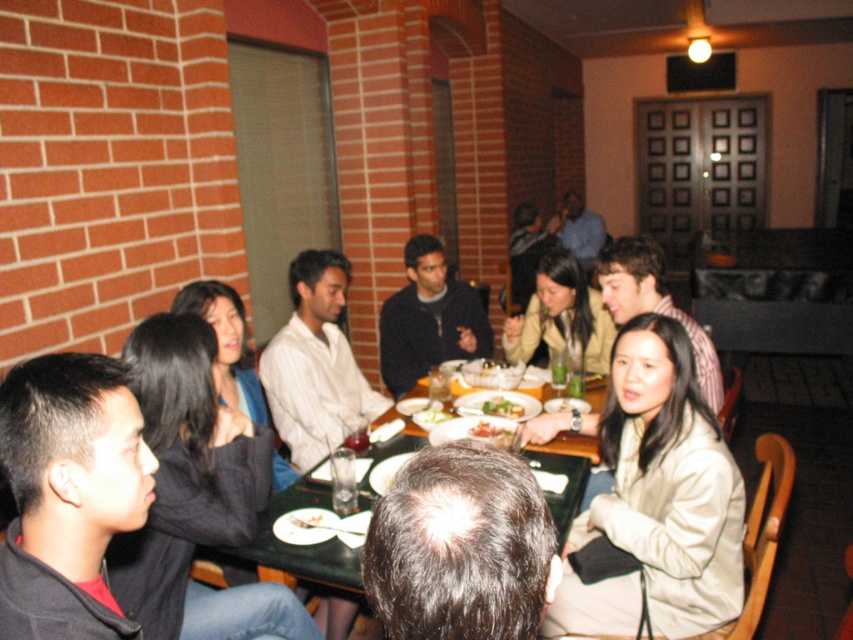
Question: Which object is the closest to the white glossy plate at center?

Choices:
 (A) dark blue sweater at center
 (B) green leafy salad at center
 (C) matte plastic fork at center
 (D) green glossy table at center

Answer: (B)

Question: Which object appears farthest from the camera in this image?

Choices:
 (A) green glossy table at center
 (B) beige fabric jacket at lower right
 (C) matte plastic fork at center
 (D) dark blue sweater at center

Answer: (D)

Question: Does dark blue sweater at center have a smaller size compared to white glossy plate at center?

Choices:
 (A) yes
 (B) no

Answer: (B)

Question: Among these points, which one is nearest to the camera?

Choices:
 (A) (482, 429)
 (B) (456, 397)

Answer: (A)

Question: Is green glossy table at center below matte plastic fork at center?

Choices:
 (A) no
 (B) yes

Answer: (B)

Question: Does green glossy table at center appear on the left side of green leafy salad at center?

Choices:
 (A) no
 (B) yes

Answer: (B)